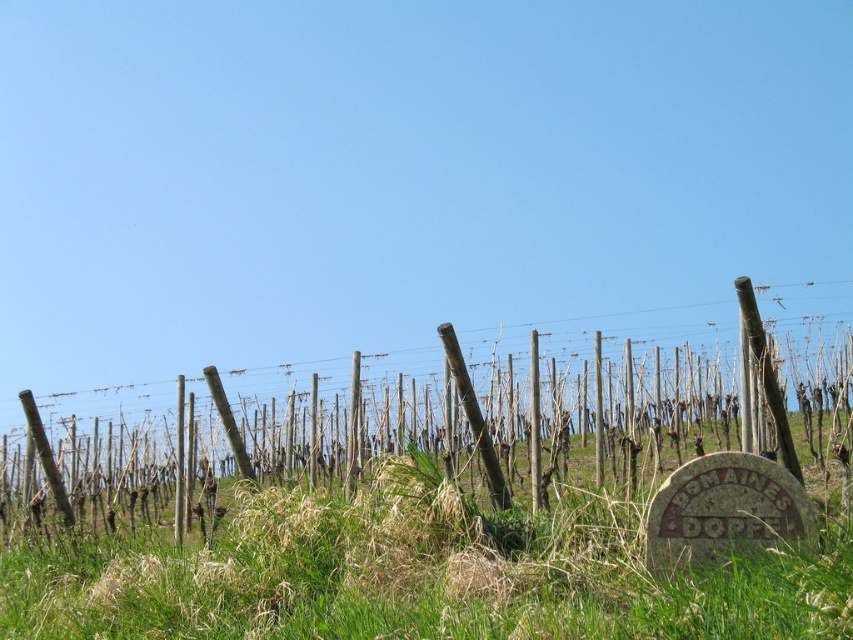
You are a gardener planning to water the green grassy at center and the brown wooden posts at center. Which object should you water first based on their relative positions?

The green grassy at center should be watered first since it is positioned over the brown wooden posts at center, meaning it is closer to the gardener and easier to access.

You are a vineyard worker who needs to place a new irrigation hose between the green grassy at center and the brown wooden posts at center. The hose is 7 meters long. Will it reach without needing to be extended?

The distance between the green grassy at center and the brown wooden posts at center is 7.42 meters. Since the hose is only 7 meters long, it will not be long enough to span the distance without extension.

You are standing in the vineyard and want to reach the circular stone marker in the lower right corner. The path is clear except for the green grassy area at center. Given that your walking distance is limited to 5 meters, can you safely walk across the green grassy at center to the marker without exceeding your limit?

The green grassy at center is 4.47 meters away from the viewer. Since the distance is within the 5 meters limit, you can safely walk across the green grassy at center to the marker without exceeding the limit.